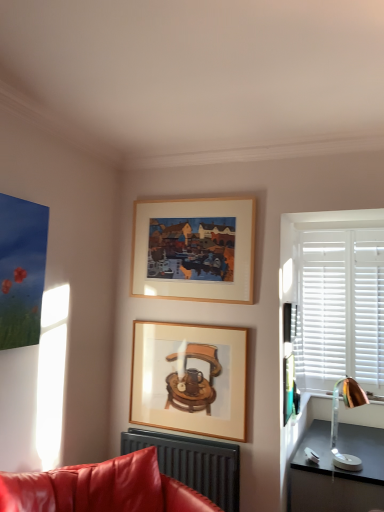
Question: From a real-world perspective, is wooden frame at upper center, the 1th picture frame viewed from the top, physically located above or below copper metallic table lamp at right?

Choices:
 (A) above
 (B) below

Answer: (A)

Question: Looking at the image, does wooden frame at upper center, the 1th picture frame viewed from the top, seem bigger or smaller compared to copper metallic table lamp at right?

Choices:
 (A) big
 (B) small

Answer: (A)

Question: Which is farther from the metallic gold lamp at right?

Choices:
 (A) matte black radiator at lower center
 (B) wooden frame at center, the second picture frame viewed from the top
 (C) copper metallic table lamp at right
 (D) wooden frame at upper center, the 1th picture frame viewed from the top

Answer: (D)

Question: Which object is positioned farthest from the metallic gold lamp at right?

Choices:
 (A) matte black radiator at lower center
 (B) wooden frame at upper center, the 1th picture frame viewed from the top
 (C) copper metallic table lamp at right
 (D) wooden frame at center, placed as the first picture frame when sorted from bottom to top

Answer: (B)